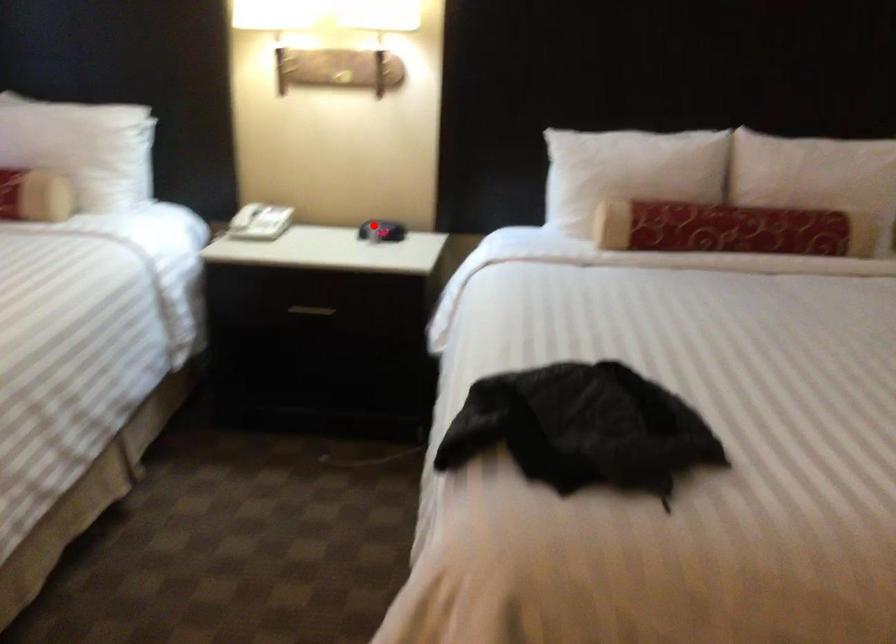
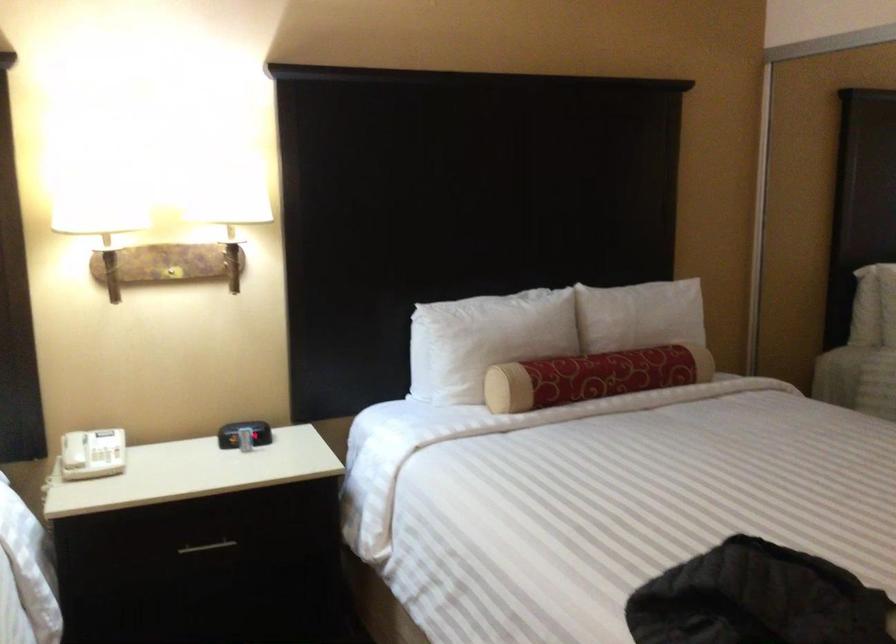
Find the pixel in the second image that matches the highlighted location in the first image.

(244, 433)